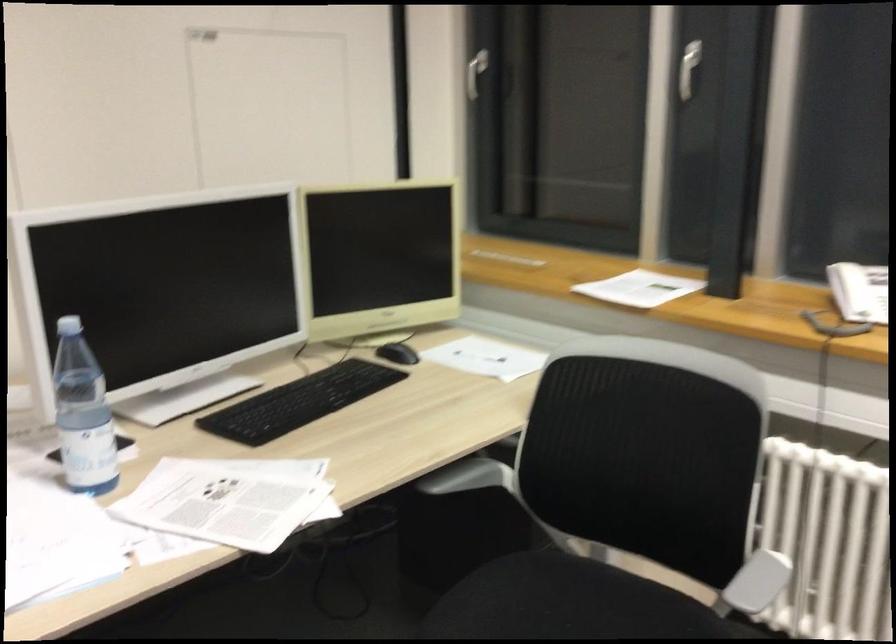
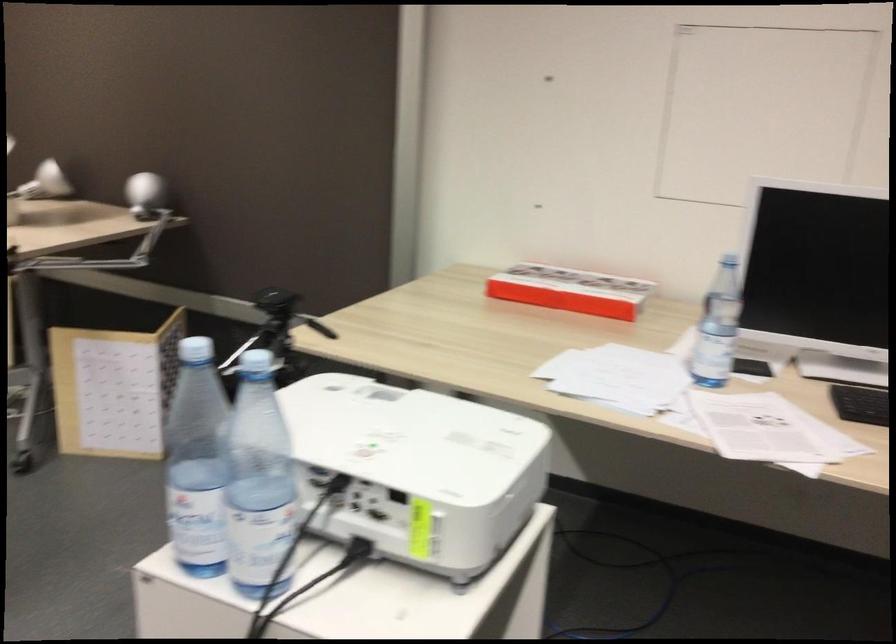
Question: The first image is from the beginning of the video and the second image is from the end. How did the camera likely rotate when shooting the video?

Choices:
 (A) Left
 (B) Right
 (C) Up
 (D) Down

Answer: (A)